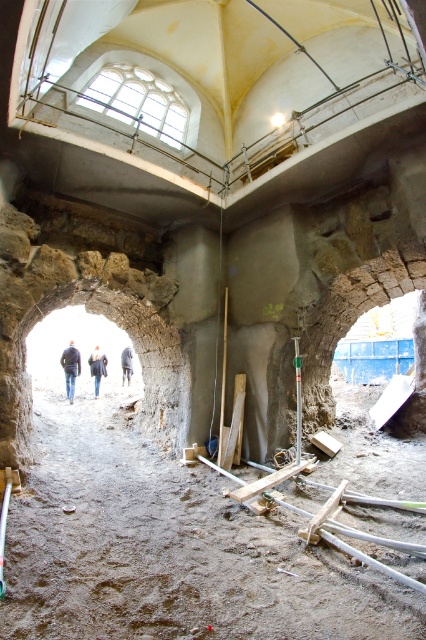
In the scene shown: You are a construction inspector standing at the entrance of the room. You see the dirt ground at center and the dark gray fabric construction worker at center. Which object is closer to you?

The dirt ground at center is closer to you because it is in front of the dark gray fabric construction worker at center.

You are a construction worker who just arrived at the site and see the blue denim jacket at center and the dark blue jeans at center. Which item is located to the left of the other?

The blue denim jacket at center is positioned on the left side of dark blue jeans at center.